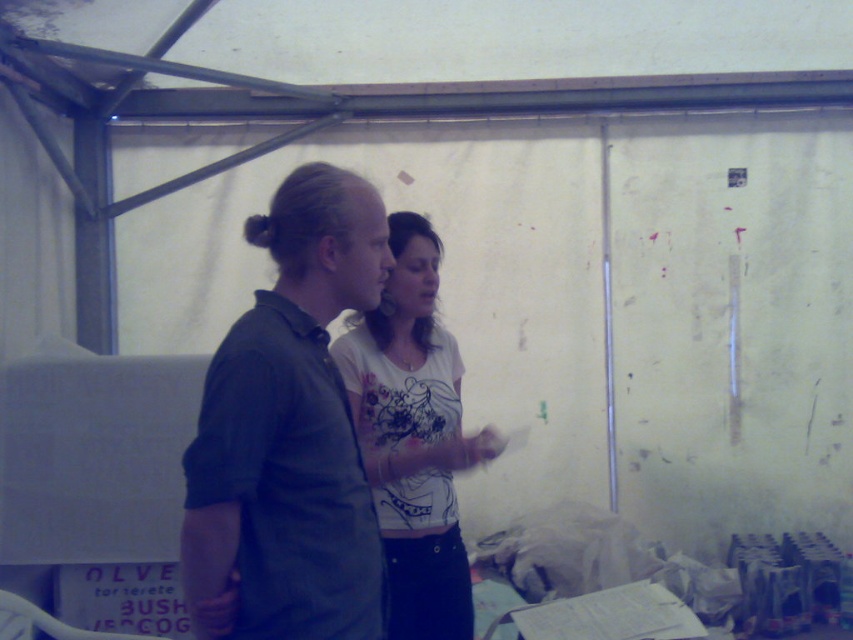
You are standing in a room with a tent structure. There is a point marked at coordinates [283,632]. If you want to place a 1.5 meter long ladder horizontally between this point and yourself, will it fit without extending beyond the point?

The distance between the point and the viewer is 1.49 meters. Since the ladder is 1.5 meters long, it will extend 0.01 meters beyond the point when placed horizontally.

You are a photographer setting up for a photo shoot. You need to ensure that both the dark green shirt at center and the white cotton shirt at center are visible in the frame. Based on their positions, which shirt should you focus on first to ensure both are in focus?

The dark green shirt at center is in front of the white cotton shirt at center, so you should focus on the dark green shirt at center first to ensure both are in focus.